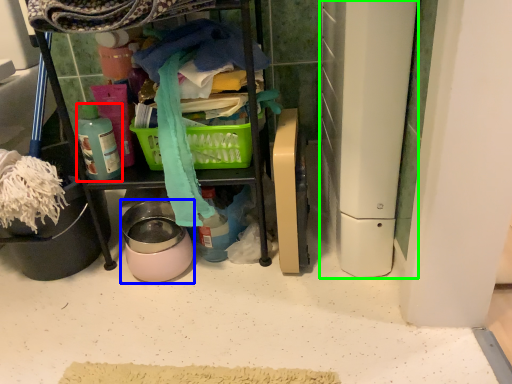
Question: Which object is positioned closest to bottle (highlighted by a red box)? Select from appliance (highlighted by a blue box) and appliance (highlighted by a green box).

Choices:
 (A) appliance
 (B) appliance

Answer: (A)